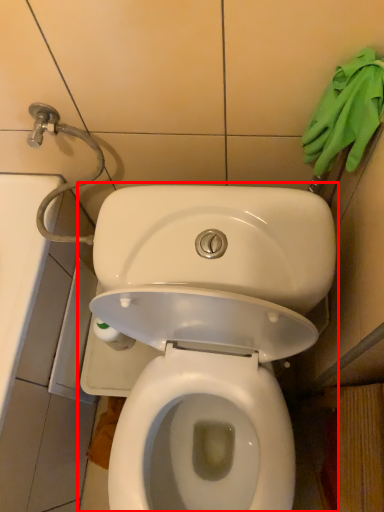
Question: From the image's perspective, where is toilet (annotated by the red box) located in relation to material in the image?

Choices:
 (A) below
 (B) above

Answer: (A)